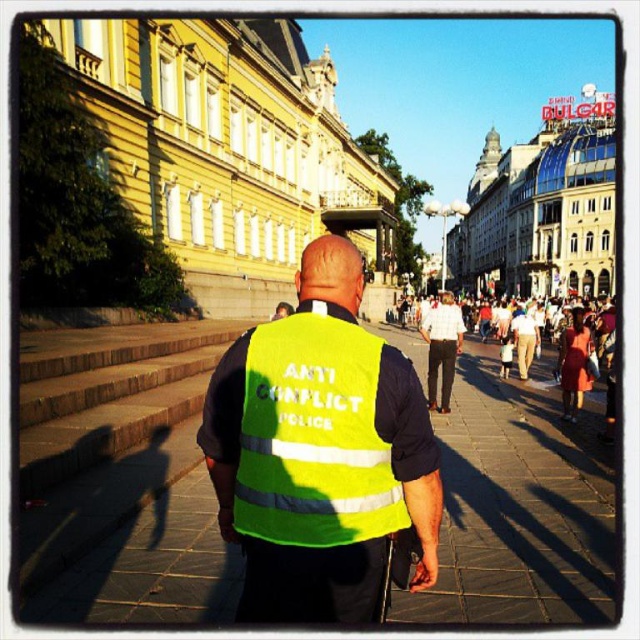
You are a photographer positioned at the center of the scene. You want to take a clear photo of the white shirt at center without the yellow reflective vest at center blocking it. Is this possible given their positions?

The yellow reflective vest at center is closer to the viewer than the white shirt at center. Since the vest is in front, it would block the view of the white shirt at center. Therefore, taking a clear photo without obstruction is not possible unless you move your position.

You are a delivery drone operator. Your drone is currently hovering above the yellow reflective vest at center. The delivery address is at the white shirt at center. Can your drone safely navigate the 60.47 feet between them without any obstacles?

The distance between the yellow reflective vest at center and the white shirt at center is 60.47 feet. Since the scene description mentions a bustling urban area with long shadows and historic buildings, there may be potential obstacles like pedestrians or structures. However, the question only asks about the navigable distance, so the drone can cover 60.47 feet. But since the scene is busy, there might be obstacles not mentioned. However, strictly based on the given info, the answer should focus on the 60.